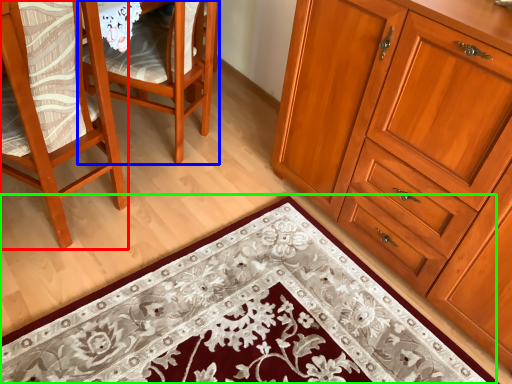
Question: Based on their relative distances, which object is farther from chair (highlighted by a red box)? Choose from chair (highlighted by a blue box) and doormat (highlighted by a green box).

Choices:
 (A) chair
 (B) doormat

Answer: (B)